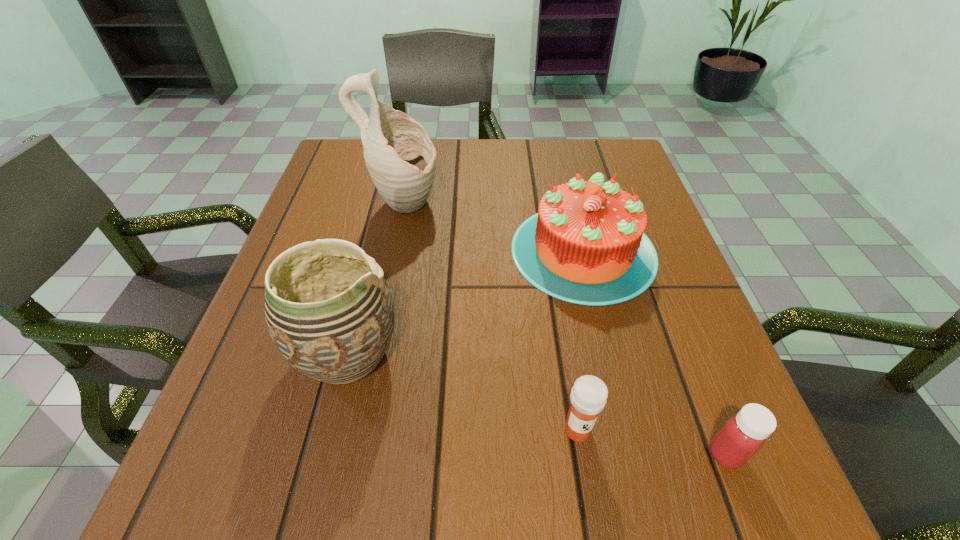
Where is `free area in between the right medicine and the cake`? The width and height of the screenshot is (960, 540). free area in between the right medicine and the cake is located at coordinates (655, 353).

Identify the location of free spot between the cake and the left medicine. (581, 340).

What are the coordinates of `free spot between the tallest object and the cake` in the screenshot? It's located at (x=493, y=228).

I want to click on empty space that is in between the pitcher and the third tallest object, so click(x=493, y=228).

This screenshot has height=540, width=960. I want to click on object that is the third nearest to the right medicine, so click(x=330, y=314).

Identify which object is the closest to the left medicine. Please provide its 2D coordinates. Your answer should be formatted as a tuple, i.e. [(x, y)], where the tuple contains the x and y coordinates of a point satisfying the conditions above.

[(743, 435)]

The width and height of the screenshot is (960, 540). In order to click on free space that satisfies the following two spatial constraints: 1. at the spout of the third tallest object; 2. on the right side of the pitcher in this screenshot , I will do `click(395, 251)`.

Identify the location of vacant space that satisfies the following two spatial constraints: 1. at the spout of the tallest object; 2. on the back side of the right medicine. (353, 454).

Find the location of a particular element. This screenshot has width=960, height=540. vacant area that satisfies the following two spatial constraints: 1. on the front side of the third nearest object; 2. on the right side of the right medicine is located at coordinates (323, 454).

Locate an element on the screen. This screenshot has height=540, width=960. blank space that satisfies the following two spatial constraints: 1. at the spout of the pitcher; 2. on the left side of the right medicine is located at coordinates (353, 454).